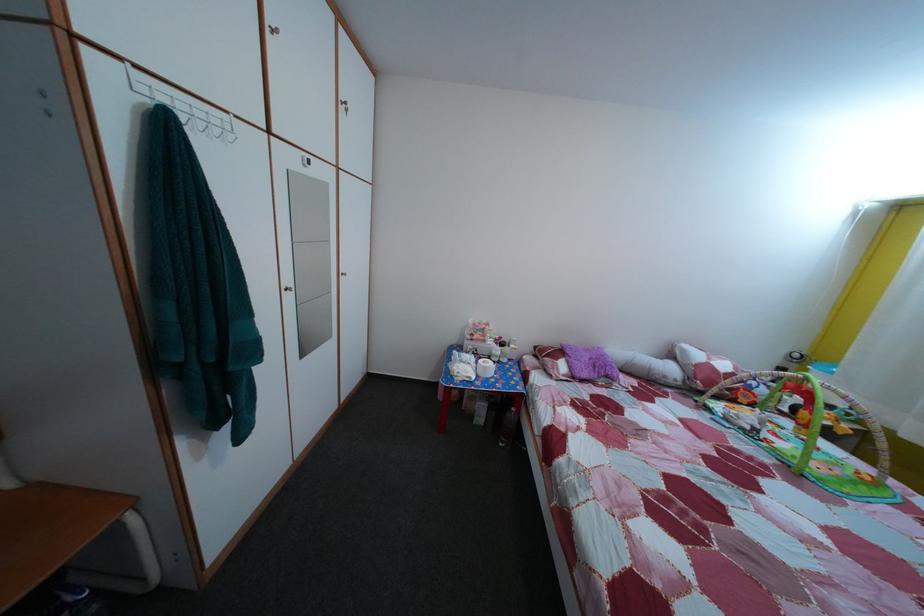
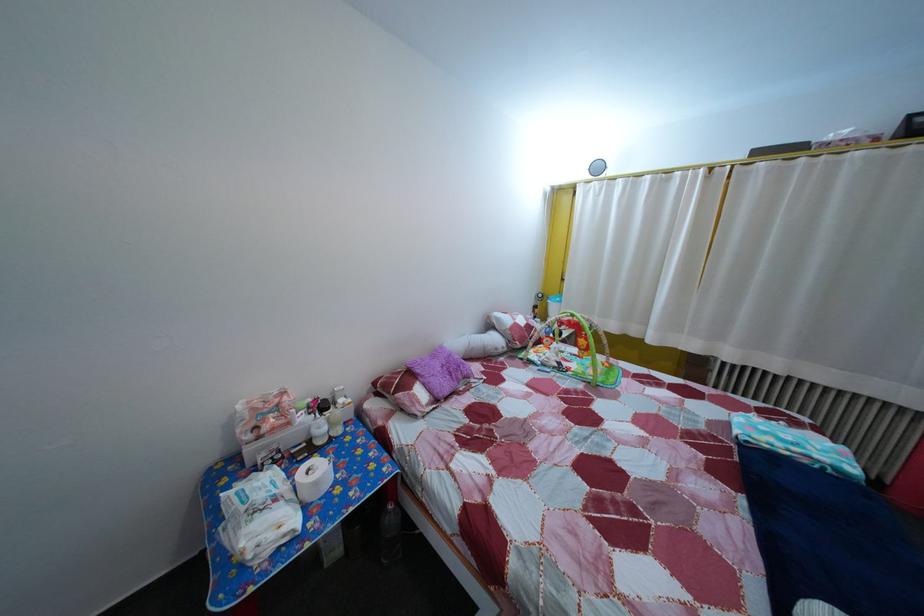
Locate, in the second image, the point that corresponds to point (479, 371) in the first image.

(285, 508)